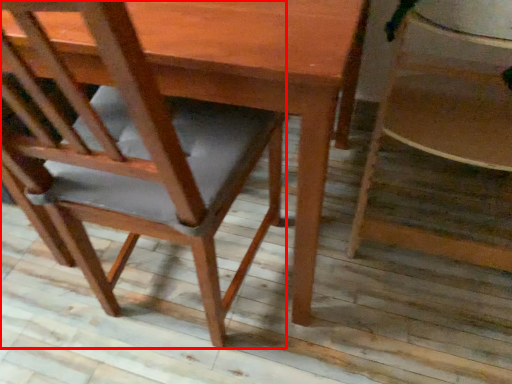
Question: Considering the relative positions of chair (annotated by the red box) and chair in the image provided, where is chair (annotated by the red box) located with respect to the staircase?

Choices:
 (A) left
 (B) right

Answer: (A)